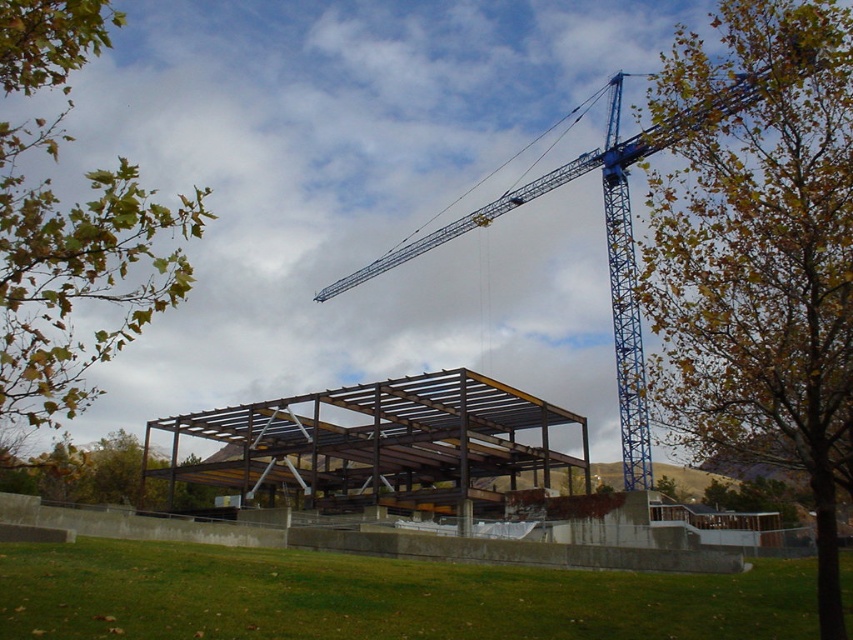
You are standing at the point marked as point (759,257) in the construction site image. You want to walk towards the blue crane located to the right of the building. Is there any obstruction between your current position and the blue crane?

The point (759,257) is occupied by a brown leafy tree at upper right, so you cannot walk towards the blue crane without moving past or around the tree.